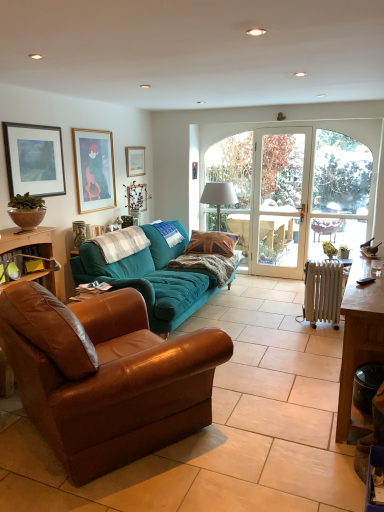
Question: Considering the positions of point (43, 164) and point (77, 240), is point (43, 164) closer or farther from the camera than point (77, 240)?

Choices:
 (A) farther
 (B) closer

Answer: (B)

Question: Considering the positions of matte black picture frame at upper left, which appears as the first picture frame when viewed from the front, and matte ceramic vase at upper left in the image, is matte black picture frame at upper left, which appears as the first picture frame when viewed from the front, wider or thinner than matte ceramic vase at upper left?

Choices:
 (A) wide
 (B) thin

Answer: (B)

Question: Estimate the real-world distances between objects in this image. Which object is closer to the teal fabric couch at center, which is the 2th studio couch in front-to-back order?

Choices:
 (A) matte black picture frame at upper left, which is counted as the third picture frame, starting from the back
 (B) brown wooden table at right
 (C) wooden picture frame at upper left, marked as the second picture frame in a back-to-front arrangement
 (D) metallic radiator at lower right
 (E) clear glass door at center

Answer: (C)

Question: Which is farther from the white fabric lampshade at center?

Choices:
 (A) brown leather couch at left, which appears as the 2th studio couch when viewed from the back
 (B) teal fabric couch at center, which is the 2th studio couch in front-to-back order
 (C) clear glass door at center
 (D) metallic radiator at lower right
 (E) wooden desk at left

Answer: (A)